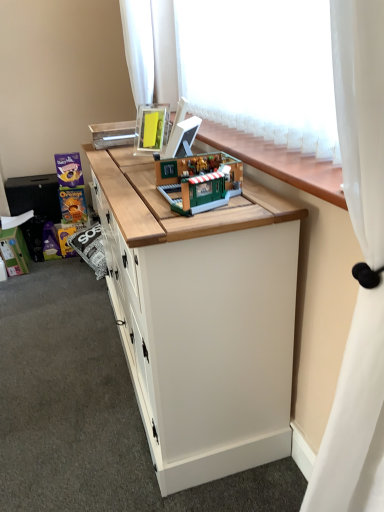
Question: From the image's perspective, is matte purple chocolate bar at left, which ranks as the second toy in front-to-back order, on white sheer curtain at upper center, which is the first curtain in top-to-bottom order?

Choices:
 (A) no
 (B) yes

Answer: (A)

Question: Is matte purple chocolate bar at left, positioned as the 2th toy in back-to-front order, facing towards white sheer curtain at upper center, placed as the first curtain when sorted from left to right?

Choices:
 (A) no
 (B) yes

Answer: (A)

Question: Is matte purple chocolate bar at left, acting as the second toy starting from the right, directly adjacent to white sheer curtain at upper center, arranged as the 2th curtain when viewed from the front?

Choices:
 (A) yes
 (B) no

Answer: (B)

Question: From a real-world perspective, is matte purple chocolate bar at left, which ranks as the second toy in front-to-back order, physically below white sheer curtain at upper center, which ranks as the second curtain in bottom-to-top order?

Choices:
 (A) no
 (B) yes

Answer: (B)

Question: Is matte purple chocolate bar at left, the second toy from the left, positioned before white sheer curtain at upper center, which is the first curtain in top-to-bottom order?

Choices:
 (A) no
 (B) yes

Answer: (A)

Question: Is matte purple chocolate bar at left, positioned as the 2th toy in back-to-front order, positioned with its back to white sheer curtain at upper center, which ranks as the second curtain in bottom-to-top order?

Choices:
 (A) no
 (B) yes

Answer: (A)

Question: Is the depth of white matte cabinet at center less than that of white sheer curtain at upper right, placed as the 2th curtain when sorted from top to bottom?

Choices:
 (A) yes
 (B) no

Answer: (B)

Question: Considering the relative sizes of white matte cabinet at center and white sheer curtain at upper right, which ranks as the 1th curtain in bottom-to-top order, in the image provided, is white matte cabinet at center shorter than white sheer curtain at upper right, which ranks as the 1th curtain in bottom-to-top order,?

Choices:
 (A) yes
 (B) no

Answer: (A)

Question: Does white matte cabinet at center have a larger size compared to white sheer curtain at upper right, which is the 1th curtain from front to back?

Choices:
 (A) yes
 (B) no

Answer: (A)

Question: From a real-world perspective, is white matte cabinet at center on white sheer curtain at upper right, placed as the 2th curtain when sorted from top to bottom?

Choices:
 (A) yes
 (B) no

Answer: (B)

Question: Is white matte cabinet at center located outside white sheer curtain at upper right, positioned as the 2th curtain in left-to-right order?

Choices:
 (A) yes
 (B) no

Answer: (A)

Question: Can you confirm if white matte cabinet at center is taller than white sheer curtain at upper right, acting as the 1th curtain starting from the right?

Choices:
 (A) no
 (B) yes

Answer: (A)

Question: Does wooden counter top at center turn towards matte purple chocolate bar at left, positioned as the 2th toy in back-to-front order?

Choices:
 (A) no
 (B) yes

Answer: (A)